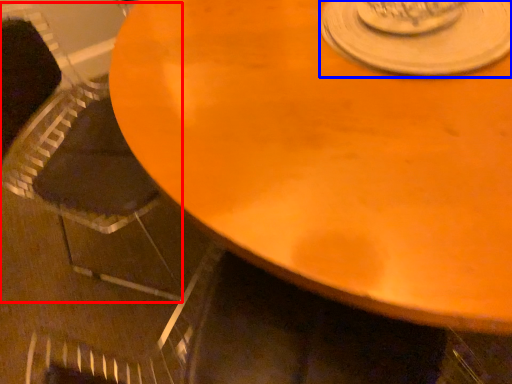
Question: Which point is further to the camera, armchair (highlighted by a red box) or saucer (highlighted by a blue box)?

Choices:
 (A) armchair
 (B) saucer

Answer: (A)